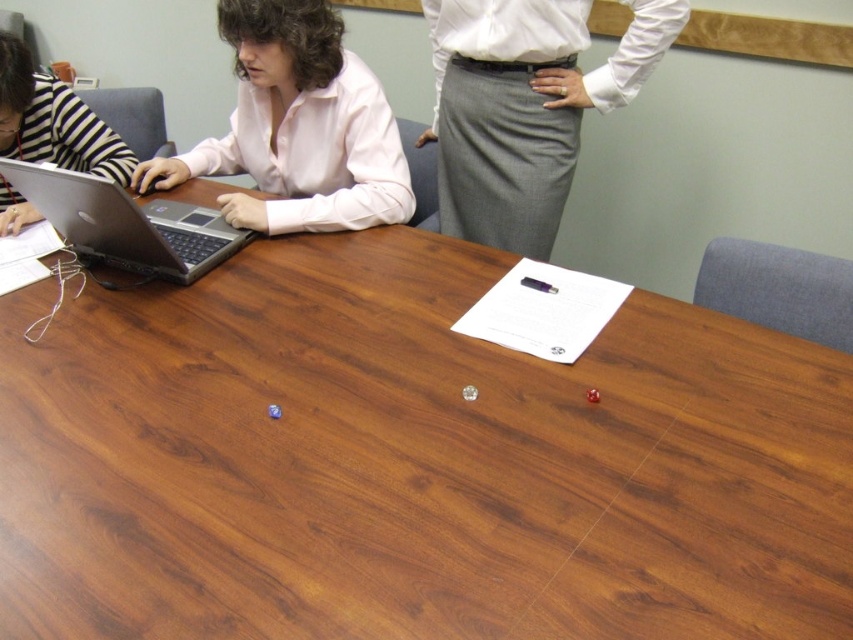
You are an interior designer observing the conference room scene. You need to determine the spatial relationship between the gray wool skirt at upper center and the striped fabric person at left. Which object is covering part of the other?

The gray wool skirt at upper center is positioned over the striped fabric person at left, meaning it is covering part of the striped fabric person at left.